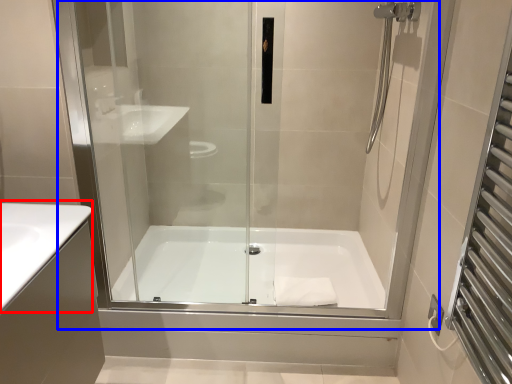
Question: Which point is further to the camera, counter top (highlighted by a red box) or shower door (highlighted by a blue box)?

Choices:
 (A) counter top
 (B) shower door

Answer: (B)